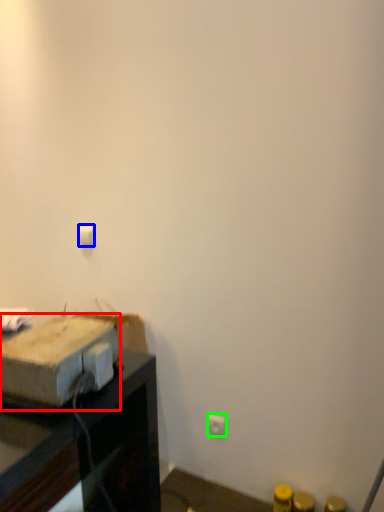
Question: Which is nearer to the cardboard box (highlighted by a red box)? light switch (highlighted by a blue box) or electric outlet (highlighted by a green box).

Choices:
 (A) light switch
 (B) electric outlet

Answer: (A)